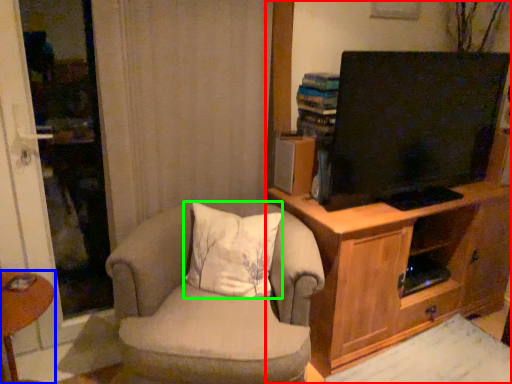
Question: Estimate the real-world distances between objects in this image. Which object is farther from cabinetry (highlighted by a red box), desk (highlighted by a blue box) or pillow (highlighted by a green box)?

Choices:
 (A) desk
 (B) pillow

Answer: (A)